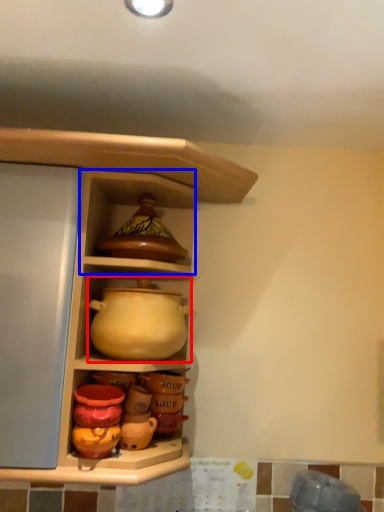
Question: Which of the following is the farthest to the observer, jug (highlighted by a red box) or cabinet (highlighted by a blue box)?

Choices:
 (A) jug
 (B) cabinet

Answer: (B)